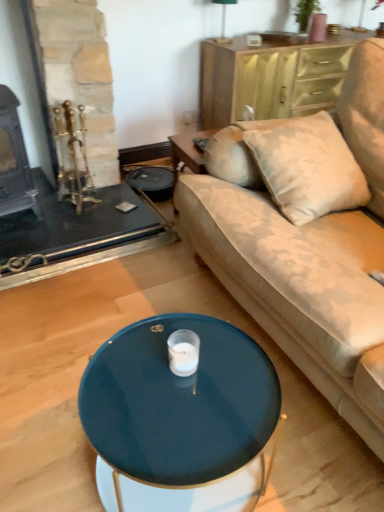
This screenshot has width=384, height=512. Identify the location of vacant space situated above glossy dark blue coffee table at center (from a real-world perspective). (172, 384).